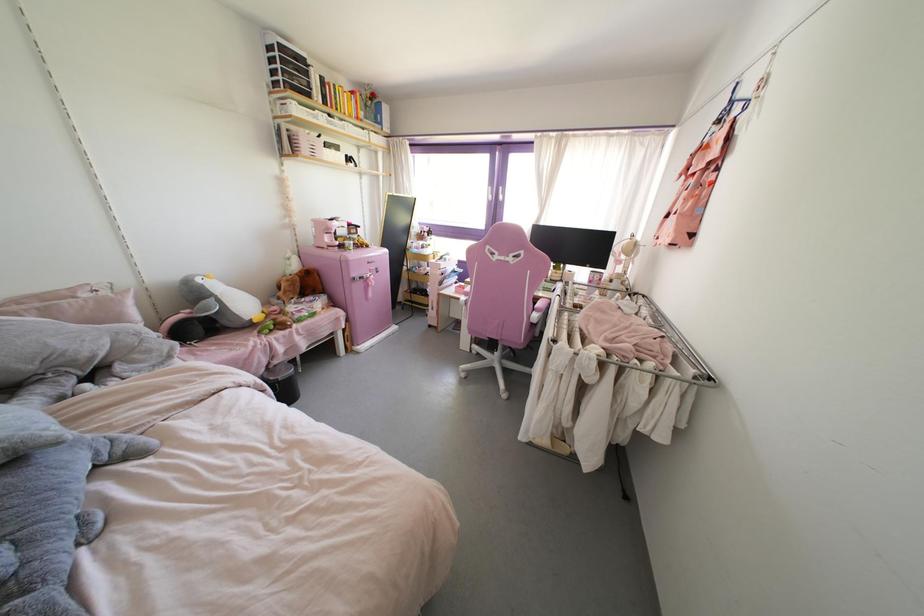
The location [314,147] corresponds to which object?

This point indicates the white storage basket.